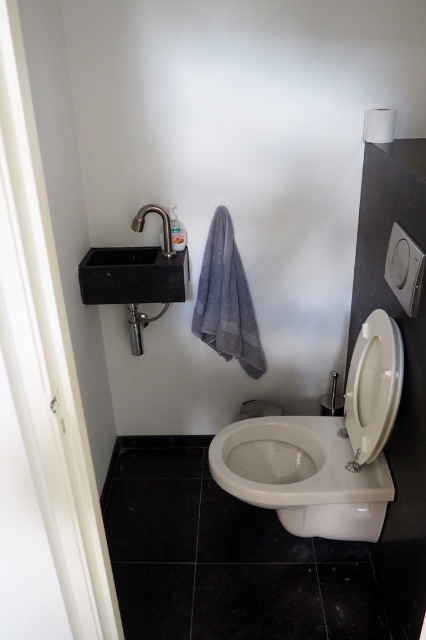
Who is taller, white plastic toilet lid at lower right or black granite sink at left?

white plastic toilet lid at lower right is taller.

Can you confirm if white plastic toilet lid at lower right is smaller than black granite sink at left?

Yes, white plastic toilet lid at lower right is smaller than black granite sink at left.

This screenshot has width=426, height=640. In order to click on white plastic toilet lid at lower right in this screenshot , I will do `click(373, 387)`.

Does white glossy toilet at center appear on the right side of white plastic toilet lid at lower right?

Incorrect, white glossy toilet at center is not on the right side of white plastic toilet lid at lower right.

Is white glossy toilet at center behind white plastic toilet lid at lower right?

Yes, white glossy toilet at center is behind white plastic toilet lid at lower right.

Find the location of a particular element. white glossy toilet at center is located at coordinates (324, 449).

Is white plastic toilet lid at lower right above gray matte towel bar at upper center?

Actually, white plastic toilet lid at lower right is below gray matte towel bar at upper center.

Does white plastic toilet lid at lower right have a lesser height compared to gray matte towel bar at upper center?

Incorrect, white plastic toilet lid at lower right's height does not fall short of gray matte towel bar at upper center's.

Identify the location of white plastic toilet lid at lower right. (373, 387).